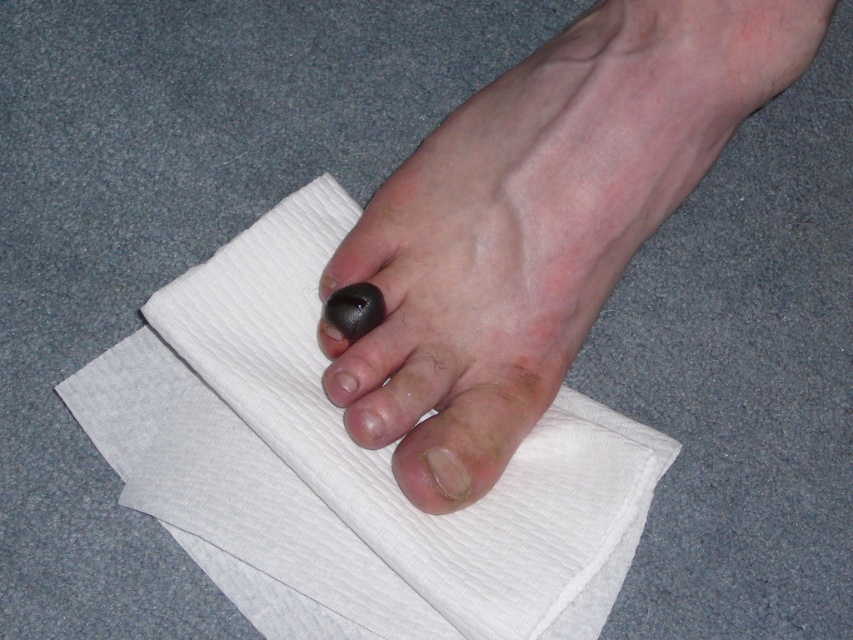
From the picture: You are a physical therapist assessing a patient who has a small object stuck under their big toe. You see the white textured cloth at center and the smooth skin toe at center. Which object is bigger and could potentially be used to help remove the object?

The white textured cloth at center is larger in size than the smooth skin toe at center, so it could be used to help remove the object.

You are a photographer adjusting the lighting in a studio setup. You notice two points of light reflected on the white textured surface under the foot. These points are labeled as point (349,336) and point (427,456). Based on their positions, which point is closer to the camera?

Point (349,336) is further to the viewer than point (427,456), so point (427,456) is closer to the camera.

You are a podiatrist examining a patient. You notice two black objects near the big toe area on the foot shown in the image. Which object is positioned closer to the patient when looking at the black matte toe at center and the black rubber toe at center?

The black matte toe at center is positioned closer to the patient than the black rubber toe at center.